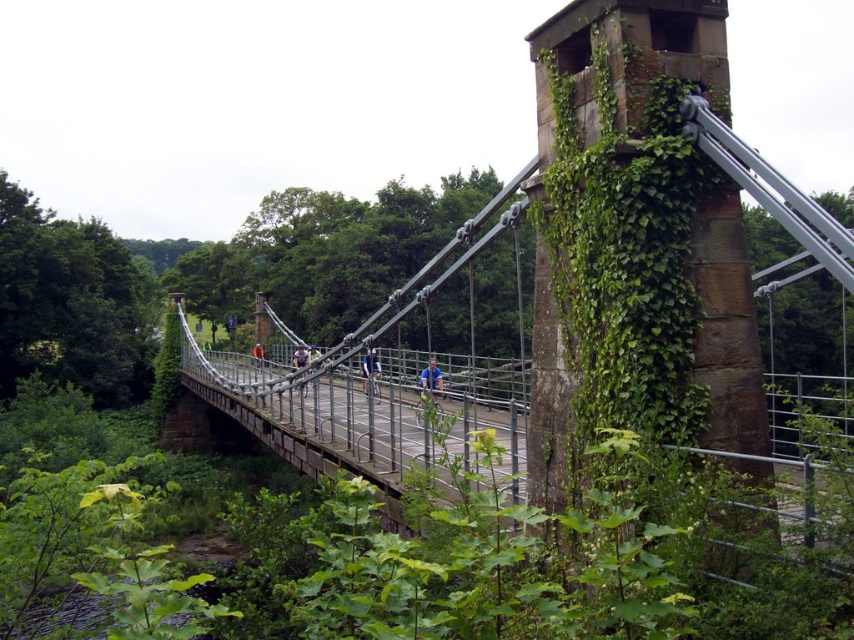
Question: Which point is closer to the camera taking this photo?

Choices:
 (A) (442, 381)
 (B) (260, 356)
 (C) (373, 444)
 (D) (379, 390)

Answer: (C)

Question: Which point is farther from the camera taking this photo?

Choices:
 (A) (434, 364)
 (B) (252, 353)

Answer: (B)

Question: Considering the relative positions of blue fabric jacket at center and orange fabric jacket at center in the image provided, where is blue fabric jacket at center located with respect to orange fabric jacket at center?

Choices:
 (A) left
 (B) right

Answer: (B)

Question: Considering the real-world distances, which object is farthest from the orange fabric jacket at center?

Choices:
 (A) metallic gray bridge at center
 (B) metallic silver bicycle at center

Answer: (B)

Question: Can you confirm if metallic silver bicycle at center is positioned to the left of orange fabric jacket at center?

Choices:
 (A) yes
 (B) no

Answer: (B)

Question: Can you confirm if metallic silver bicycle at center is positioned to the right of orange fabric jacket at center?

Choices:
 (A) yes
 (B) no

Answer: (A)